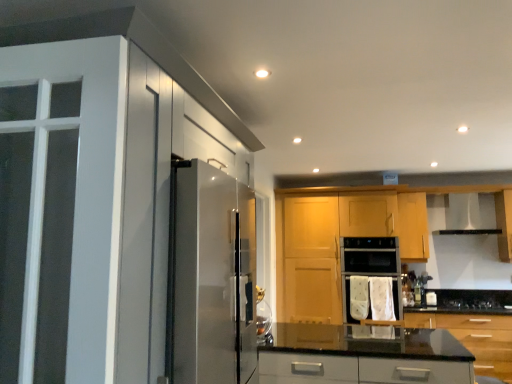
Question: Does wooden cabinet at center, which appears as the second cabinetry when viewed from the right, have a greater width compared to white fabric oven at center?

Choices:
 (A) no
 (B) yes

Answer: (B)

Question: Is wooden cabinet at center, which appears as the second cabinetry when viewed from the right, taller than white fabric oven at center?

Choices:
 (A) yes
 (B) no

Answer: (A)

Question: Considering the relative sizes of wooden cabinet at center, which appears as the second cabinetry when viewed from the right, and white fabric oven at center in the image provided, is wooden cabinet at center, which appears as the second cabinetry when viewed from the right, shorter than white fabric oven at center?

Choices:
 (A) no
 (B) yes

Answer: (A)

Question: From the image's perspective, does wooden cabinet at center, which appears as the second cabinetry when viewed from the right, appear higher than white fabric oven at center?

Choices:
 (A) no
 (B) yes

Answer: (B)

Question: Considering the relative sizes of wooden cabinet at center, which appears as the second cabinetry when viewed from the right, and white fabric oven at center in the image provided, is wooden cabinet at center, which appears as the second cabinetry when viewed from the right, smaller than white fabric oven at center?

Choices:
 (A) no
 (B) yes

Answer: (A)

Question: In terms of size, does white glossy cabinet at left, positioned as the 1th cabinetry in left-to-right order, appear bigger or smaller than glossy wood cabinets at center, the 3th cabinetry from the right?

Choices:
 (A) small
 (B) big

Answer: (B)

Question: Based on their positions, is white glossy cabinet at left, acting as the fourth cabinetry starting from the right, located to the left or right of glossy wood cabinets at center, the 3th cabinetry from the right?

Choices:
 (A) right
 (B) left

Answer: (B)

Question: From the image's perspective, relative to glossy wood cabinets at center, the 3th cabinetry from the right, is white glossy cabinet at left, acting as the fourth cabinetry starting from the right, above or below?

Choices:
 (A) below
 (B) above

Answer: (B)

Question: Is point (160, 344) positioned closer to the camera than point (371, 360)?

Choices:
 (A) closer
 (B) farther

Answer: (A)

Question: Looking at their shapes, would you say white glossy cabinet at left, acting as the fourth cabinetry starting from the right, is wider or thinner than satin silver exhaust hood at upper right?

Choices:
 (A) wide
 (B) thin

Answer: (A)

Question: From the image's perspective, is white glossy cabinet at left, acting as the fourth cabinetry starting from the right, above or below satin silver exhaust hood at upper right?

Choices:
 (A) above
 (B) below

Answer: (B)

Question: Considering the positions of white glossy cabinet at left, acting as the fourth cabinetry starting from the right, and satin silver exhaust hood at upper right in the image, is white glossy cabinet at left, acting as the fourth cabinetry starting from the right, bigger or smaller than satin silver exhaust hood at upper right?

Choices:
 (A) small
 (B) big

Answer: (B)

Question: Visually, is white glossy cabinet at left, acting as the fourth cabinetry starting from the right, positioned to the left or to the right of satin silver exhaust hood at upper right?

Choices:
 (A) right
 (B) left

Answer: (B)

Question: In terms of height, does white glossy cabinet at left, positioned as the 1th cabinetry in left-to-right order, look taller or shorter compared to black glass gas stove at lower center?

Choices:
 (A) tall
 (B) short

Answer: (A)

Question: From the image's perspective, is white glossy cabinet at left, acting as the fourth cabinetry starting from the right, positioned above or below black glass gas stove at lower center?

Choices:
 (A) below
 (B) above

Answer: (B)